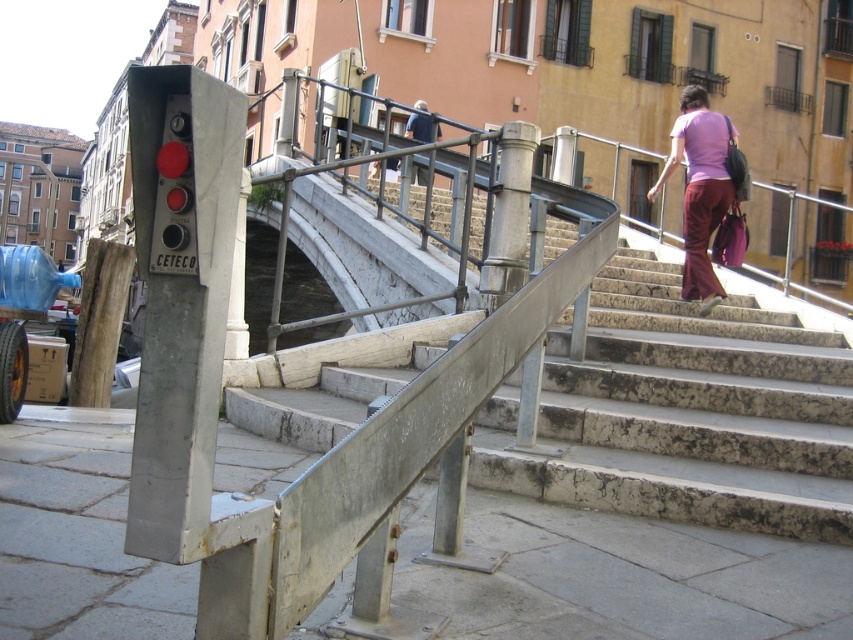
What do you see at coordinates (683, 413) in the screenshot?
I see `stone stairs at upper center` at bounding box center [683, 413].

Does point (607, 289) lie in front of point (708, 164)?

No, (607, 289) is further to viewer.

Locate an element on the screen. This screenshot has height=640, width=853. stone stairs at upper center is located at coordinates [683, 413].

Can you confirm if pink fabric pants at upper right is thinner than dark blue jacket at upper center?

No.

Between pink fabric pants at upper right and dark blue jacket at upper center, which one is positioned higher?

dark blue jacket at upper center

Measure the distance between point (718,177) and camera.

6.89 meters

You are a GUI agent. You are given a task and a screenshot of the screen. Output one action in this format:
    pyautogui.click(x=<x>, y=<y>)
    Task: Click on the pink fabric pants at upper right
    The width and height of the screenshot is (853, 640).
    Given the screenshot: What is the action you would take?
    pyautogui.click(x=699, y=189)

Which is behind, point (793, 385) or point (422, 116)?

Positioned behind is point (422, 116).

Is point (740, 305) positioned behind point (425, 138)?

No, (740, 305) is in front of (425, 138).

In order to click on stone stairs at upper center in this screenshot , I will do `click(683, 413)`.